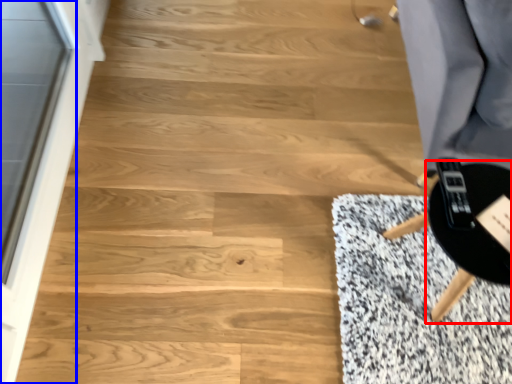
Question: Which object is closer to the camera taking this photo, round table (highlighted by a red box) or screen door (highlighted by a blue box)?

Choices:
 (A) round table
 (B) screen door

Answer: (B)